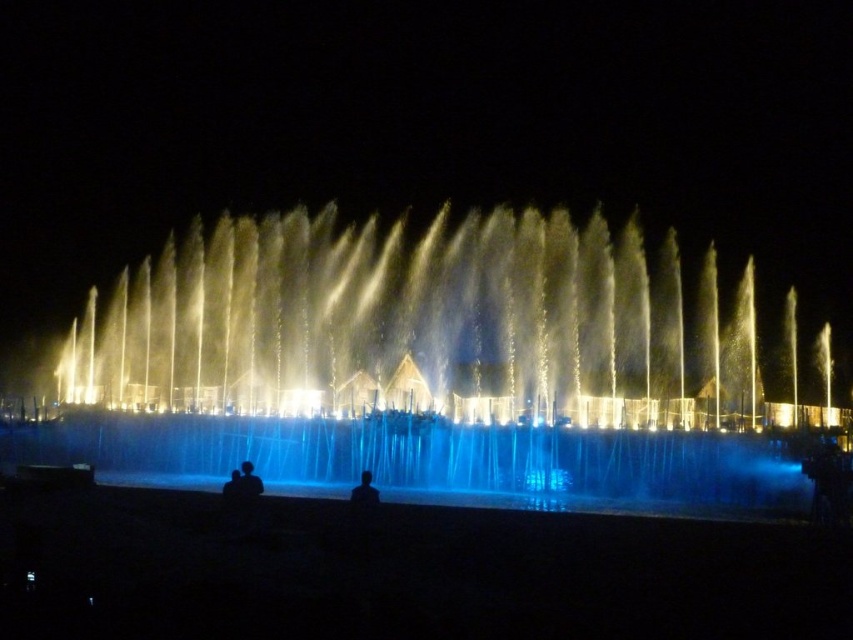
Question: Which object appears farthest from the camera in this image?

Choices:
 (A) silhouette figure at center
 (B) black matte person at lower center

Answer: (A)

Question: Is the position of blue liquid at center more distant than that of silhouette skin at lower center?

Choices:
 (A) yes
 (B) no

Answer: (A)

Question: Is blue liquid at center to the right of black matte person at lower center from the viewer's perspective?

Choices:
 (A) yes
 (B) no

Answer: (A)

Question: Considering the real-world distances, which object is farthest from the silhouette skin at lower center?

Choices:
 (A) blue liquid at center
 (B) black matte person at lower center

Answer: (A)

Question: Does black matte person at lower center appear on the right side of silhouette figure at center?

Choices:
 (A) no
 (B) yes

Answer: (B)

Question: Which is farther from the silhouette skin at lower center?

Choices:
 (A) blue liquid at center
 (B) silhouette figure at center
 (C) black matte person at lower center

Answer: (A)